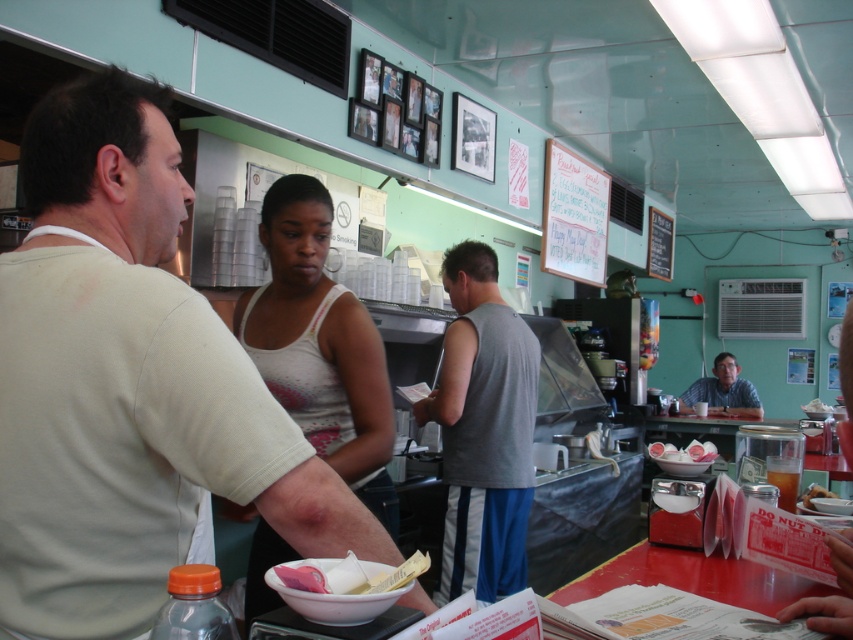
You are a customer entering the diner and want to sit at the counter. You see the gray fabric tank top at center and the matte gray shirt at upper right. Which of these two items is taller?

The gray fabric tank top at center is taller than the matte gray shirt at upper right.

You are a fashion designer observing the diner scene. You notice two tank tops worn by the people there. Which tank top has a thinner fabric? Please refer to the description of the white tank top at center and the gray fabric tank top at center.

The white tank top at center has a thinner fabric than the gray fabric tank top at center.

You are a waiter in the diner and need to deliver a drink to the customer wearing the gray fabric tank top at center and another drink to the customer in the matte gray shirt at upper right. Which customer should you approach first to ensure you serve them in the order of proximity?

You should first approach the gray fabric tank top at center because it is closer to the viewer than the matte gray shirt at upper right, so it is nearer.